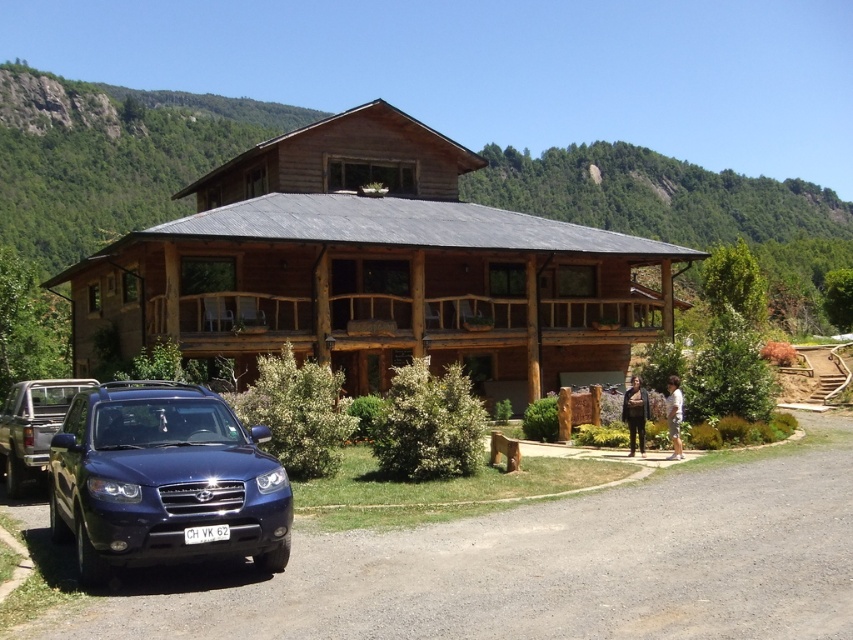
Is point (148, 588) closer to viewer compared to point (3, 408)?

Yes, it is.

Does smooth asphalt driveway at lower left have a lesser height compared to matte blue suv at lower left?

No.

Is point (222, 616) less distant than point (62, 410)?

That is True.

Find the location of `smooth asphalt driveway at lower left`. smooth asphalt driveway at lower left is located at coordinates coord(543,564).

Between satin blue suv at lower left and brown wooden porch at center, which one is positioned higher?

brown wooden porch at center is higher up.

Is point (132, 476) farther from viewer compared to point (490, 339)?

No, (132, 476) is in front of (490, 339).

Is point (178, 436) positioned after point (241, 301)?

No, it is not.

Identify the location of satin blue suv at lower left. (163, 481).

Locate an element on the screen. brown wooden cabin at center is located at coordinates (374, 269).

Does brown wooden cabin at center have a larger size compared to matte blue suv at lower left?

Yes.

You are a GUI agent. You are given a task and a screenshot of the screen. Output one action in this format:
    pyautogui.click(x=<x>, y=<y>)
    Task: Click on the brown wooden cabin at center
    Image resolution: width=853 pixels, height=640 pixels.
    Given the screenshot: What is the action you would take?
    pyautogui.click(x=374, y=269)